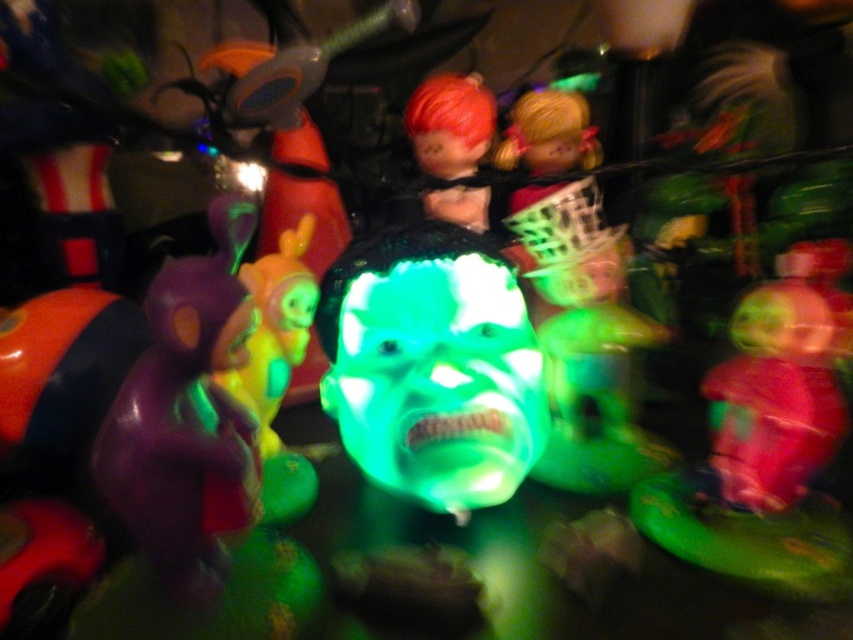
Does green translucent mask at center have a lesser height compared to shiny red hair at upper center?

Correct, green translucent mask at center is not as tall as shiny red hair at upper center.

Which is in front, point (477, 332) or point (476, 122)?

Point (477, 332) is more forward.

At what (x,y) coordinates should I click in order to perform the action: click on green translucent mask at center. Please return your answer as a coordinate pair (x, y). This screenshot has height=640, width=853. Looking at the image, I should click on (432, 365).